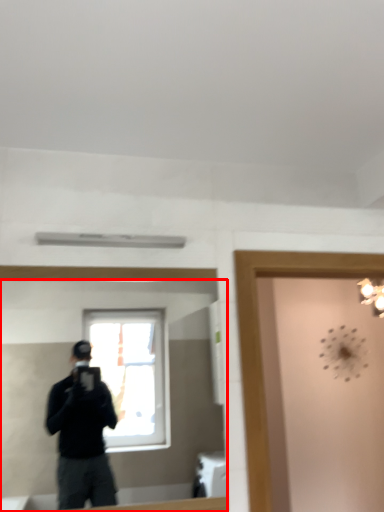
Question: In this image, where is mirror (annotated by the red box) located relative to glass door?

Choices:
 (A) left
 (B) right

Answer: (A)